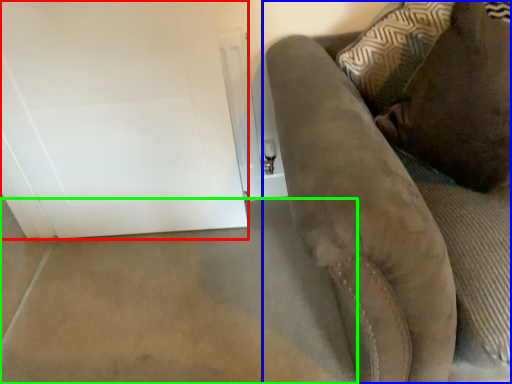
Question: Which object is the closest to the glass door (highlighted by a red box)? Choose among these: furniture (highlighted by a blue box) or concrete (highlighted by a green box).

Choices:
 (A) furniture
 (B) concrete

Answer: (B)